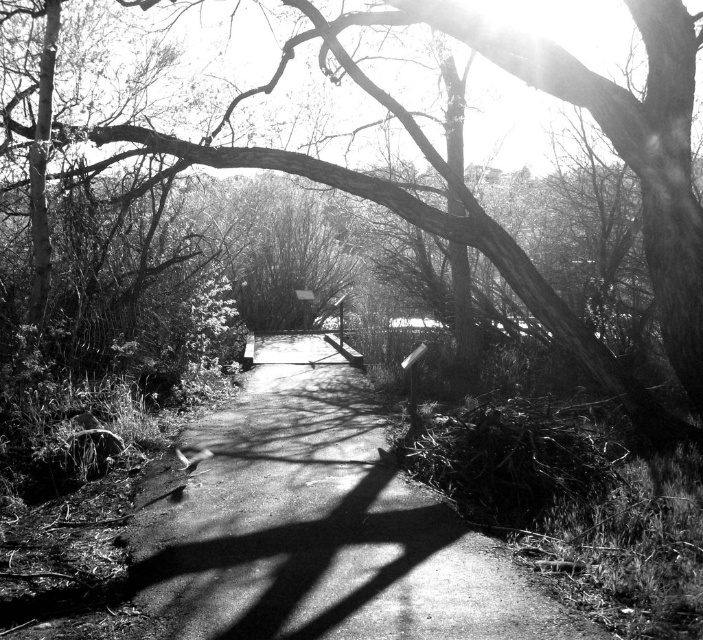
You are a hiker carrying a 1.2 meter wide tent. You need to set up camp along the smooth concrete path at center. Can the path accommodate your tent without overlapping onto the smooth bark tree at center?

The smooth concrete path at center is thinner than the smooth bark tree at center. Since the path is narrower than the tree, and your tent is 1.2 meters wide, the path may not be wide enough to fit the tent without overlapping the tree. Check the actual width of the path before setting up.

You are standing at the start of the smooth concrete path at center and want to reach the wooden bridge in the distance. To your left, there is a smooth bark tree at center. Which direction should you walk to stay on the path leading to the bridge?

The smooth concrete path at center is positioned on the right side of the smooth bark tree at center, so you should walk to the right of the smooth bark tree at center to stay on the path leading to the bridge.